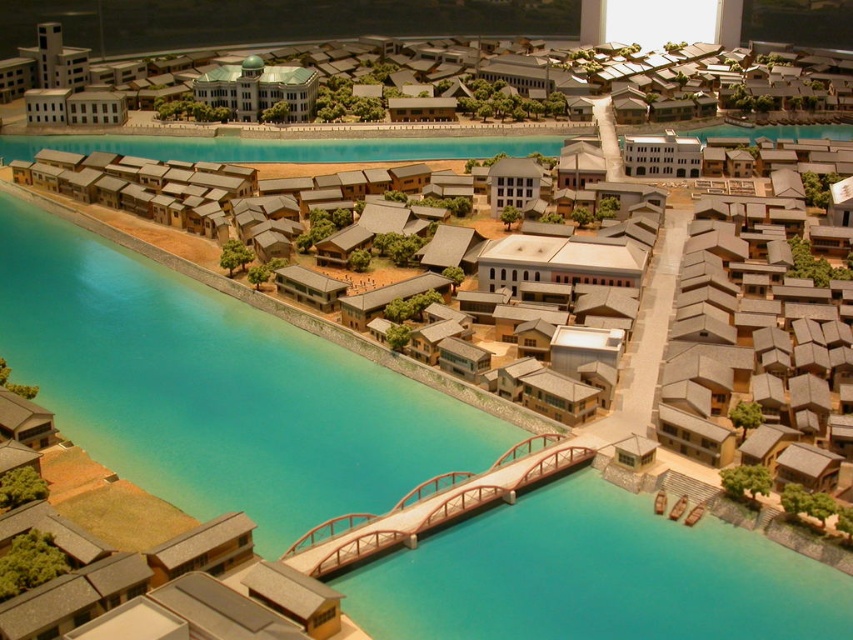
Between point (405, 502) and point (271, 104), which one is positioned behind?

The point (271, 104) is more distant.

Is point (408, 538) positioned before point (297, 81)?

Yes, it is in front of point (297, 81).

Who is more forward, [316,561] or [262,77]?

Point [316,561] is in front.

Identify the location of wooden bridge at center. This screenshot has width=853, height=640. (433, 506).

Is transparent blue water at center further to camera compared to wooden bridge at center?

That is False.

Measure the distance between transparent blue water at center and camera.

They are 251.80 feet apart.

Find the location of a particular element. This screenshot has width=853, height=640. transparent blue water at center is located at coordinates (213, 385).

Which is more to the right, transparent blue water at center or matte white building at center?

transparent blue water at center

Is transparent blue water at center below matte white building at center?

Correct, transparent blue water at center is located below matte white building at center.

Between point (74, 349) and point (303, 113), which one is positioned behind?

Positioned behind is point (303, 113).

Identify the location of transparent blue water at center. (213, 385).